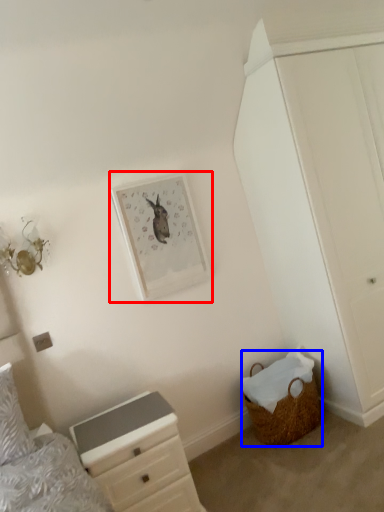
Question: Which object appears farthest to the camera in this image, picture frame (highlighted by a red box) or basket (highlighted by a blue box)?

Choices:
 (A) picture frame
 (B) basket

Answer: (A)